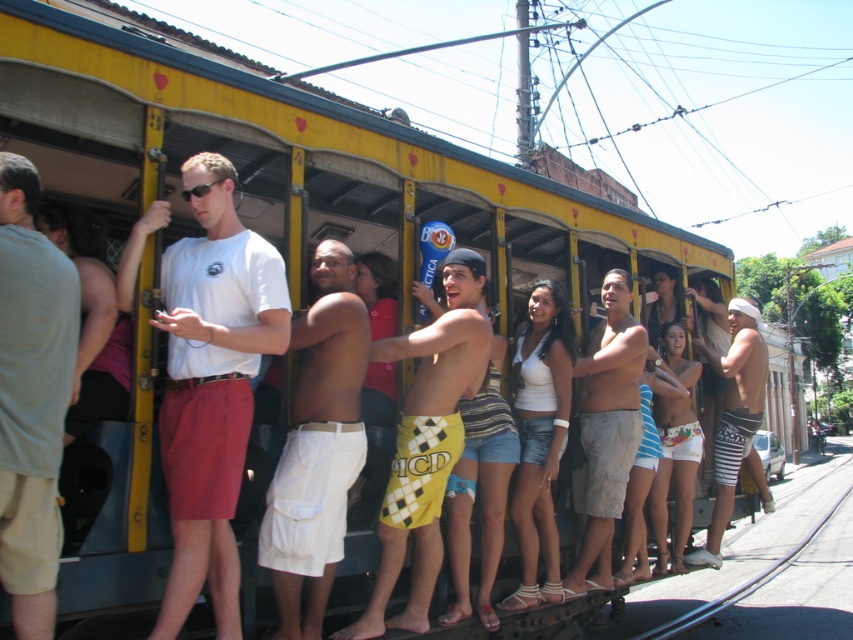
Consider the image. Who is more distant from viewer, (49, 520) or (480, 380)?

The point (480, 380) is behind.

Is point (57, 358) farther from viewer compared to point (403, 516)?

That is False.

In order to click on light gray cotton t-shirt at left in this screenshot , I will do `click(32, 396)`.

Who is taller, yellow checkered shorts at center or metallic gray train track at lower right?

Standing taller between the two is metallic gray train track at lower right.

What do you see at coordinates (426, 442) in the screenshot?
I see `yellow checkered shorts at center` at bounding box center [426, 442].

Which is in front, point (473, 282) or point (705, 616)?

Point (473, 282)

Locate an element on the screen. The width and height of the screenshot is (853, 640). yellow checkered shorts at center is located at coordinates (426, 442).

Between metallic gray train track at lower right and tan cargo shorts at center, which one is positioned lower?

Positioned lower is metallic gray train track at lower right.

Does metallic gray train track at lower right lie behind tan cargo shorts at center?

Yes, metallic gray train track at lower right is further from the viewer.

You are a GUI agent. You are given a task and a screenshot of the screen. Output one action in this format:
    pyautogui.click(x=<x>, y=<y>)
    Task: Click on the metallic gray train track at lower right
    The width and height of the screenshot is (853, 640).
    Given the screenshot: What is the action you would take?
    pyautogui.click(x=782, y=576)

The image size is (853, 640). In order to click on metallic gray train track at lower right in this screenshot , I will do `click(782, 576)`.